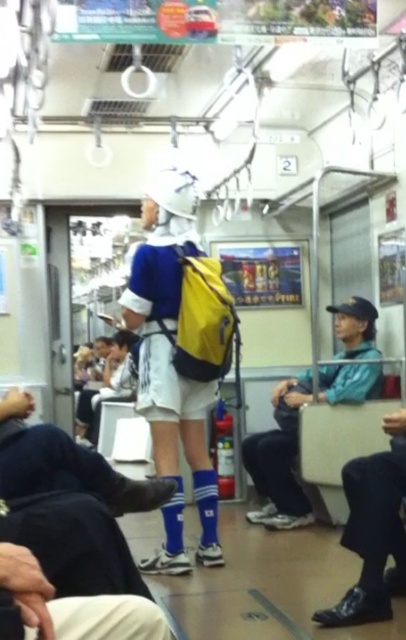
You are a passenger on the subway train and need to find the matte blue jersey at center. Based on the coordinates provided in the scene description, can you determine its exact position relative to the train car?

The matte blue jersey at center is located at coordinates point (170, 365), which places it near the middle of the train car.

You are a passenger on a subway train and you see a matte blue jersey at center and a teal matte jacket at center. Which item takes up more space in the scene?

The teal matte jacket at center takes up more space in the scene than the matte blue jersey at center because the matte blue jersey at center occupies less space than teal matte jacket at center.

You are a photographer trying to capture both the matte blue jersey at center and the teal matte jacket at center in the same frame. Based on their positions, which one should you focus on first to ensure both are in the shot?

The matte blue jersey at center is positioned on the left side of the teal matte jacket at center, so focusing on the teal matte jacket at center first will allow you to frame both objects by adjusting the camera to include the leftward positioned jersey.